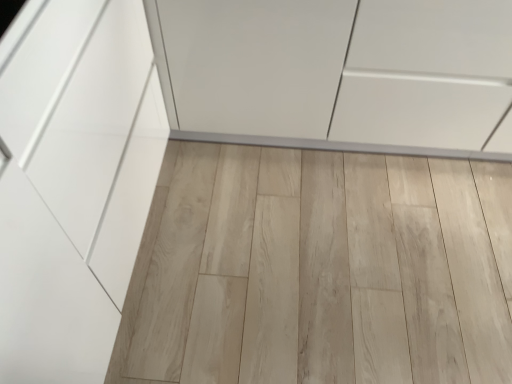
Identify the location of free location above natural wood plank at center (from a real-world perspective). The image size is (512, 384). (314, 239).